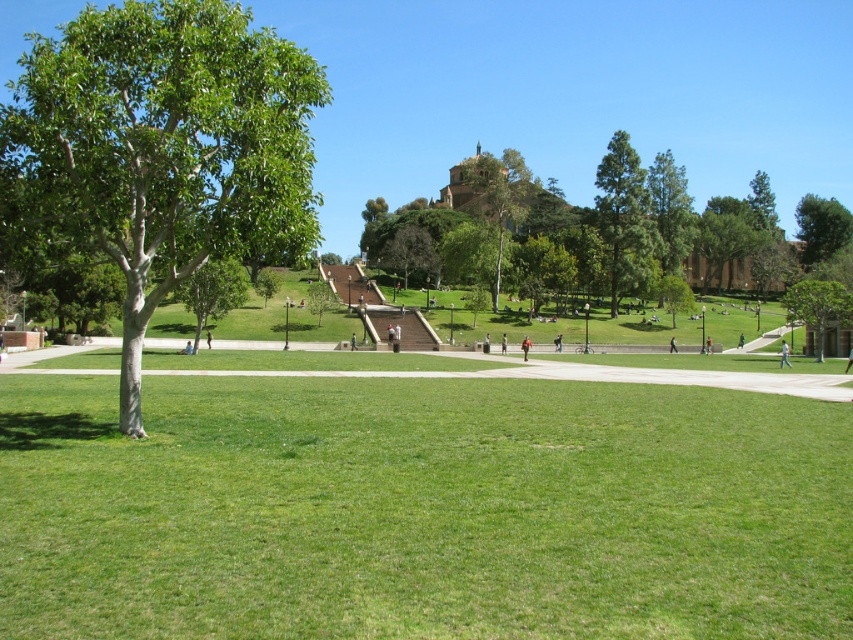
Consider the image. You are a photographer setting up a tripod in the park. You notice the skinny jeans at center and the light brown wooden bench at center. Which object should you place your camera higher to capture the top of?

The skinny jeans at center is much taller than the light brown wooden bench at center, so you should place your camera higher to capture the top of the skinny jeans at center.